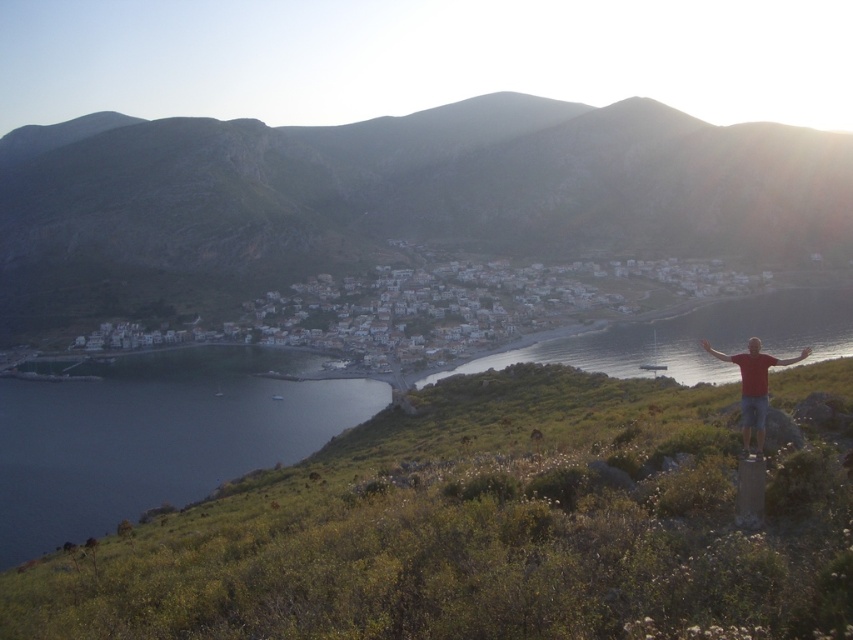
Question: Can you confirm if green grassy hillside at lower right is positioned to the right of light brown leather hand at upper right?

Choices:
 (A) yes
 (B) no

Answer: (B)

Question: Does rugged stone mountain at center lie behind dark blue water at lower left?

Choices:
 (A) yes
 (B) no

Answer: (A)

Question: Among these objects, which one is farthest from the camera?

Choices:
 (A) smooth skin hand at right
 (B) dark blue water at lower left
 (C) red matte arm at right

Answer: (B)

Question: Among these objects, which one is farthest from the camera?

Choices:
 (A) dark blue water at lower left
 (B) red matte arm at right
 (C) red cotton shirt at lower right

Answer: (A)

Question: Is rugged stone mountain at center further to camera compared to smooth skin hand at right?

Choices:
 (A) no
 (B) yes

Answer: (B)

Question: Which is nearer to the smooth skin hand at right?

Choices:
 (A) green grassy hillside at lower right
 (B) dark blue water at lower left
 (C) red matte arm at right

Answer: (C)